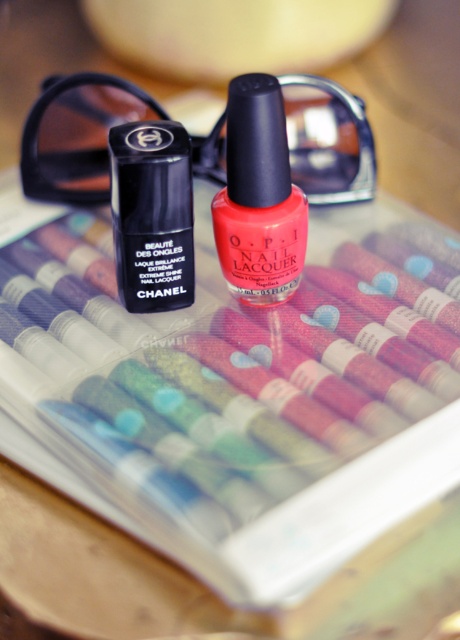
Question: Based on their relative distances, which object is farther from the shiny coral nail polish at center?

Choices:
 (A) black plastic goggles at center
 (B) matte black nail polish at center

Answer: (A)

Question: Which object is the farthest from the matte black nail polish at center?

Choices:
 (A) black plastic goggles at center
 (B) shiny coral nail polish at center

Answer: (A)

Question: Can you confirm if black plastic goggles at center is positioned above shiny coral nail polish at center?

Choices:
 (A) no
 (B) yes

Answer: (B)

Question: Is shiny coral nail polish at center bigger than matte black nail polish at center?

Choices:
 (A) yes
 (B) no

Answer: (A)

Question: Does black plastic goggles at center lie in front of shiny coral nail polish at center?

Choices:
 (A) yes
 (B) no

Answer: (B)

Question: Estimate the real-world distances between objects in this image. Which object is farther from the black plastic goggles at center?

Choices:
 (A) matte black nail polish at center
 (B) shiny coral nail polish at center

Answer: (A)